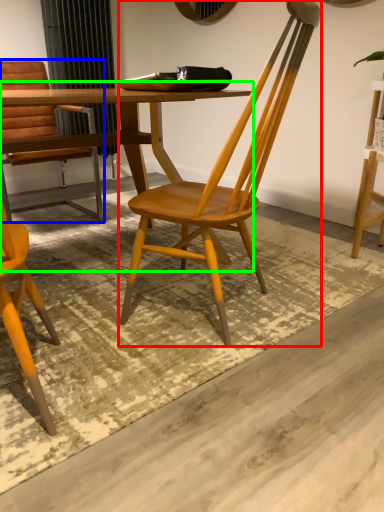
Question: Which is farther away from chair (highlighted by a red box)? chair (highlighted by a blue box) or table (highlighted by a green box)?

Choices:
 (A) chair
 (B) table

Answer: (A)